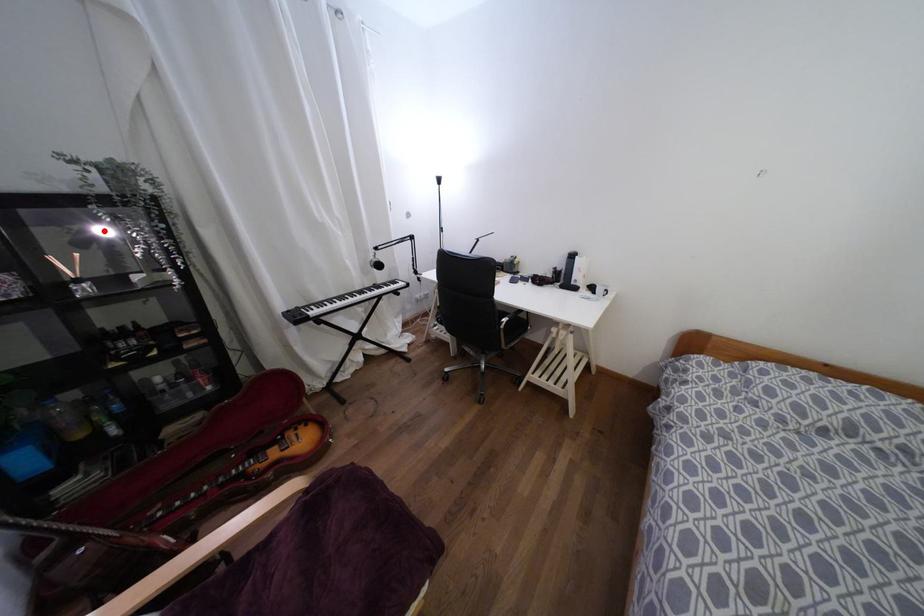
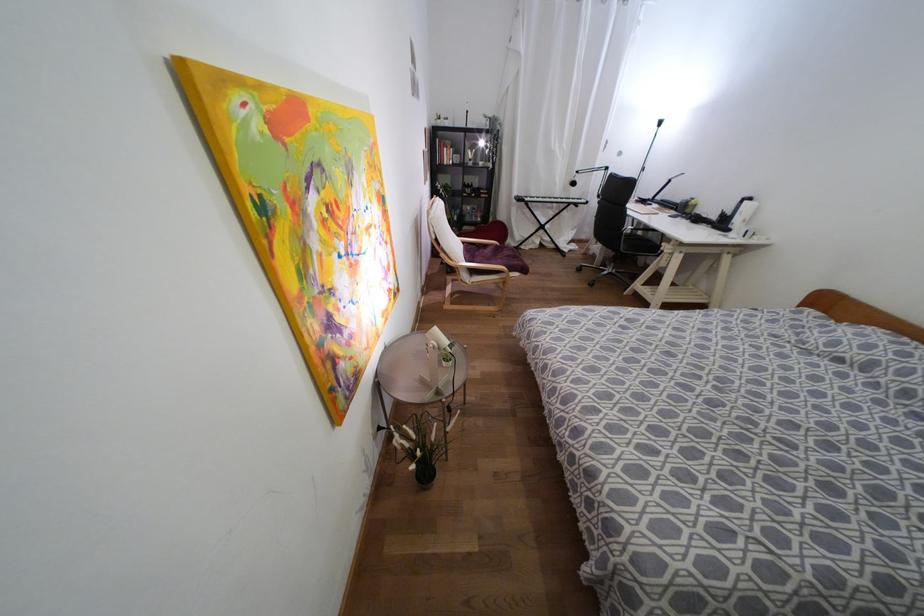
Question: I am providing you with two images of the same scene from different viewpoints. Given a red point in image1, look at the same physical point in image2. Is it:

Choices:
 (A) Closer to the viewpoint
 (B) Farther from the viewpoint

Answer: (A)